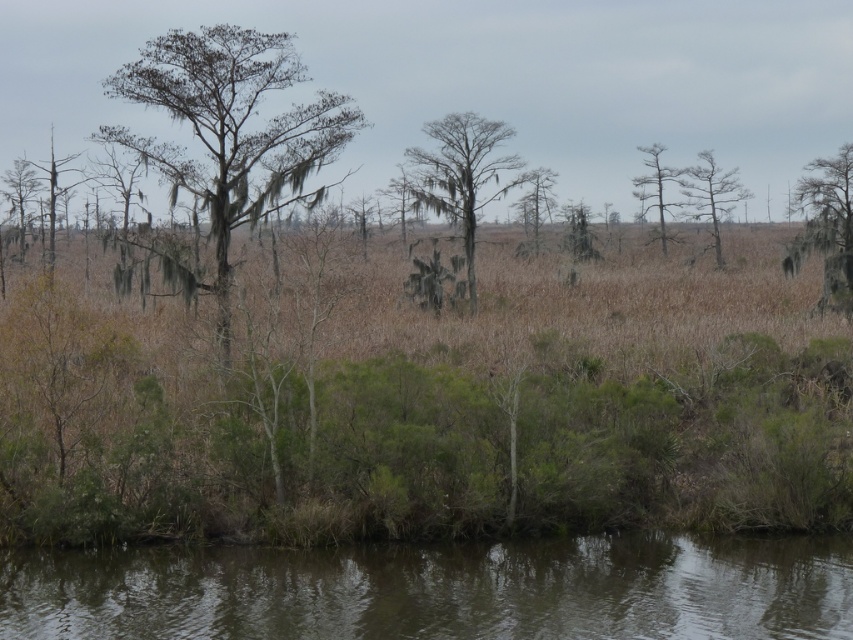
Is green mossy tree at upper right to the right of smooth gray tree at upper right from the viewer's perspective?

Correct, you'll find green mossy tree at upper right to the right of smooth gray tree at upper right.

Does point (827, 304) lie in front of point (653, 182)?

Yes, point (827, 304) is in front of point (653, 182).

Locate an element on the screen. This screenshot has width=853, height=640. green mossy tree at upper right is located at coordinates (827, 227).

Can you confirm if green mossy tree at center is positioned to the left of smooth bark tree at center?

Yes, green mossy tree at center is to the left of smooth bark tree at center.

Find the location of a particular element. This screenshot has width=853, height=640. green mossy tree at center is located at coordinates (463, 176).

Can you confirm if brown mossy tree at center is bigger than green mossy tree at center?

Indeed, brown mossy tree at center has a larger size compared to green mossy tree at center.

Between brown mossy tree at center and green mossy tree at center, which one has more height?

Standing taller between the two is brown mossy tree at center.

Find the location of a particular element. The height and width of the screenshot is (640, 853). brown mossy tree at center is located at coordinates (231, 129).

Where is `brown mossy tree at center`? brown mossy tree at center is located at coordinates (231, 129).